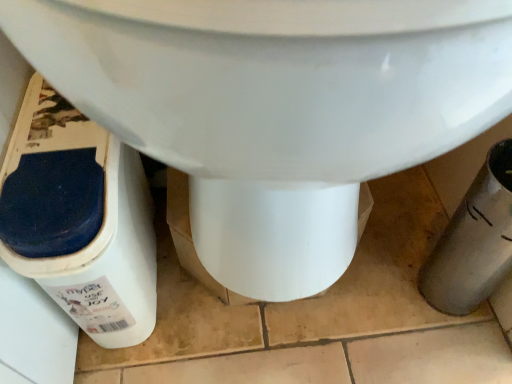
I want to click on vacant area located to the right-hand side of white plastic potty at lower left, so click(243, 319).